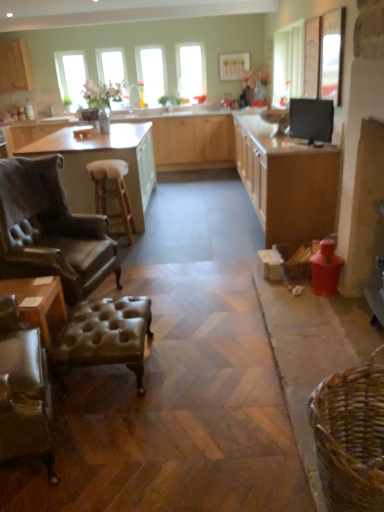
Measure the distance between point [79,307] and camera.

Point [79,307] and camera are 2.63 meters apart.

The image size is (384, 512). Describe the element at coordinates (311, 119) in the screenshot. I see `black glossy monitor at upper right` at that location.

Measure the distance between point (x=177, y=112) and camera.

22.68 feet.

Describe the element at coordinates (151, 72) in the screenshot. I see `clear glass window at center, the 2th window viewed from the left` at that location.

Describe the element at coordinates (38, 302) in the screenshot. This screenshot has width=384, height=512. I see `wooden table at lower left, the first table ordered from the bottom` at that location.

I want to click on leather tufted stool at lower left, so click(x=104, y=336).

Is leather armchair at left with matte wood cabinet at upper left, which is the 3th cabinetry in right-to-left order?

No, leather armchair at left is not in contact with matte wood cabinet at upper left, which is the 3th cabinetry in right-to-left order.

In the scene shown: From the image's perspective, is leather armchair at left above or below matte wood cabinet at upper left, which is counted as the 1th cabinetry, starting from the left?

leather armchair at left is below matte wood cabinet at upper left, which is counted as the 1th cabinetry, starting from the left.

Which object is closer to the camera, leather armchair at left or matte wood cabinet at upper left, which is counted as the 1th cabinetry, starting from the left?

Positioned in front is leather armchair at left.

How many degrees apart are the facing directions of leather armchair at left and matte wood cabinet at upper left, which is the 3th cabinetry in right-to-left order?

The facing directions of leather armchair at left and matte wood cabinet at upper left, which is the 3th cabinetry in right-to-left order, are 13.1 degrees apart.

From their relative heights in the image, would you say clear glass window at upper center, which is counted as the third window, starting from the left, is taller or shorter than matte wood cabinet at upper left, which is the 3th cabinetry in right-to-left order?

Considering their sizes, clear glass window at upper center, which is counted as the third window, starting from the left, has more height than matte wood cabinet at upper left, which is the 3th cabinetry in right-to-left order.

Is the position of clear glass window at upper center, acting as the 1th window starting from the right, less distant than that of matte wood cabinet at upper left, which is counted as the 1th cabinetry, starting from the left?

No.

The width and height of the screenshot is (384, 512). In order to click on the 2nd cabinetry to the left of the clear glass window at upper center, which is counted as the third window, starting from the left, starting your count from the anchor in this screenshot , I will do `click(15, 66)`.

Is leather tufted stool at lower left at the left side of matte wood countertop at center?

Incorrect, leather tufted stool at lower left is not on the left side of matte wood countertop at center.

From the image's perspective, which is above, leather tufted stool at lower left or matte wood countertop at center?

matte wood countertop at center, from the image's perspective.

Considering the sizes of objects leather tufted stool at lower left and matte wood countertop at center in the image provided, who is smaller, leather tufted stool at lower left or matte wood countertop at center?

leather tufted stool at lower left.

Locate an element on the screen. The image size is (384, 512). basket that appears below the leather armchair at left (from the image's perspective) is located at coordinates (351, 436).

Can you see leather armchair at left touching brown woven basket at lower right?

They are not placed beside each other.

Consider the image. Is leather armchair at left inside or outside of brown woven basket at lower right?

leather armchair at left exists outside the volume of brown woven basket at lower right.

Which point is more distant from viewer, (27, 217) or (366, 475)?

The point (27, 217) is behind.

Relative to brown leather table at left, which is the 2th table from front to back, is clear glass window at upper center, which is counted as the third window, starting from the left, in front or behind?

In the image, clear glass window at upper center, which is counted as the third window, starting from the left, appears behind brown leather table at left, which is the 2th table from front to back.

Between clear glass window at upper center, acting as the 1th window starting from the right, and brown leather table at left, which is counted as the second table, starting from the bottom, which one appears on the right side from the viewer's perspective?

clear glass window at upper center, acting as the 1th window starting from the right.

From the image's perspective, which object appears higher, clear glass window at upper center, acting as the 1th window starting from the right, or brown leather table at left, positioned as the first table in back-to-front order?

clear glass window at upper center, acting as the 1th window starting from the right, is shown above in the image.

Is point (61, 132) in front of point (27, 67)?

That is True.

Is brown leather table at left, positioned as the first table in back-to-front order, placed right next to matte wood cabinet at upper left, which is the 3th cabinetry in right-to-left order?

No, brown leather table at left, positioned as the first table in back-to-front order, is not touching matte wood cabinet at upper left, which is the 3th cabinetry in right-to-left order.

Is brown leather table at left, positioned as the first table in back-to-front order, facing towards matte wood cabinet at upper left, which is counted as the 1th cabinetry, starting from the left?

No.

From the image's perspective, between brown leather table at left, which is the 2th table from front to back, and matte wood cabinet at upper left, which is counted as the 1th cabinetry, starting from the left, who is located below?

brown leather table at left, which is the 2th table from front to back, from the image's perspective.

Is brown leather table at left, the 1th table positioned from the top, oriented towards leather tufted stool at lower left?

No, brown leather table at left, the 1th table positioned from the top, is not facing towards leather tufted stool at lower left.

Considering the sizes of objects brown leather table at left, the 1th table positioned from the top, and leather tufted stool at lower left in the image provided, who is thinner, brown leather table at left, the 1th table positioned from the top, or leather tufted stool at lower left?

With smaller width is leather tufted stool at lower left.

From a real-world perspective, between brown leather table at left, which is the 2th table from front to back, and leather tufted stool at lower left, who is vertically lower?

leather tufted stool at lower left is physically lower.

The width and height of the screenshot is (384, 512). What are the coordinates of `cabinetry that appears above the leather armchair at left (from a real-world perspective)` in the screenshot? It's located at (15, 66).

Locate an element on the screen. the 1st cabinetry in front of the clear glass window at upper center, which is counted as the third window, starting from the left, counting from the anchor's position is located at coordinates (15, 66).

Consider the image. Which object lies further to the anchor point white leather stool at center, matte wood cabinetry at center, which ranks as the 2th cabinetry in left-to-right order, or clear glass window at center, which ranks as the 2th window in right-to-left order?

clear glass window at center, which ranks as the 2th window in right-to-left order, is positioned further to the anchor white leather stool at center.

Considering their positions, is matte wood cabinetry at center, the 2th cabinetry when ordered from right to left, positioned further to wooden table at lower left, the first table when ordered from front to back, than matte wood cabinet at upper left, which is counted as the 1th cabinetry, starting from the left?

matte wood cabinet at upper left, which is counted as the 1th cabinetry, starting from the left, is positioned further to the anchor wooden table at lower left, the first table when ordered from front to back.

Considering their positions, is black glossy monitor at upper right positioned further to matte wood cabinetry at center, the 2th cabinetry when ordered from right to left, than matte wood countertop at center?

Based on the image, black glossy monitor at upper right appears to be further to matte wood cabinetry at center, the 2th cabinetry when ordered from right to left.

Considering their positions, is leather armchair at left positioned further to black glossy monitor at upper right than leather tufted stool at lower left?

Among the two, leather tufted stool at lower left is located further to black glossy monitor at upper right.

Considering their positions, is matte wood cabinet at upper left, which is the 3th cabinetry in right-to-left order, positioned closer to brown leather table at left, which is counted as the second table, starting from the bottom, than matte wood cabinetry at center, which ranks as the 2th cabinetry in left-to-right order?

The object closer to brown leather table at left, which is counted as the second table, starting from the bottom, is matte wood cabinetry at center, which ranks as the 2th cabinetry in left-to-right order.

From the image, which object appears to be farther from brown leather table at left, positioned as the first table in back-to-front order, matte wood countertop at center or clear glass window at upper center?

clear glass window at upper center.

Considering their positions, is wooden table at lower left, the first table when ordered from front to back, positioned further to wooden cabinet at right, which ranks as the third cabinetry in left-to-right order, than black glossy monitor at upper right?

The object further to wooden cabinet at right, which ranks as the third cabinetry in left-to-right order, is wooden table at lower left, the first table when ordered from front to back.

In the scene shown: Looking at the image, which one is located closer to matte wood cabinet at upper left, which is counted as the 1th cabinetry, starting from the left, leather tufted stool at lower left or brown leather table at left, which is the 2th table from front to back?

brown leather table at left, which is the 2th table from front to back, is closer to matte wood cabinet at upper left, which is counted as the 1th cabinetry, starting from the left.

At what (x,y) coordinates should I click in order to perform the action: click on chair between leather tufted stool at lower left and clear glass window at center, the 2th window viewed from the left, in the front-back direction. Please return your answer as a coordinate pair (x, y). The height and width of the screenshot is (512, 384). Looking at the image, I should click on coord(50,230).

This screenshot has width=384, height=512. What are the coordinates of `window screen between leather armchair at left and clear glass window at upper left, the third window viewed from the right, along the z-axis` in the screenshot? It's located at (112, 74).

At what (x,y) coordinates should I click in order to perform the action: click on cabinetry between white leather stool at center and clear glass window at center, which ranks as the 2th window in right-to-left order, from front to back. Please return your answer as a coordinate pair (x, y). This screenshot has width=384, height=512. Looking at the image, I should click on (15, 66).

You are a GUI agent. You are given a task and a screenshot of the screen. Output one action in this format:
    pyautogui.click(x=<x>, y=<y>)
    Task: Click on the bar stool situated between wooden table at lower left, the 2th table from the back, and wooden cabinet at right, arranged as the 1th cabinetry when viewed from the right, from left to right
    This screenshot has height=512, width=384.
    Given the screenshot: What is the action you would take?
    pyautogui.click(x=104, y=336)